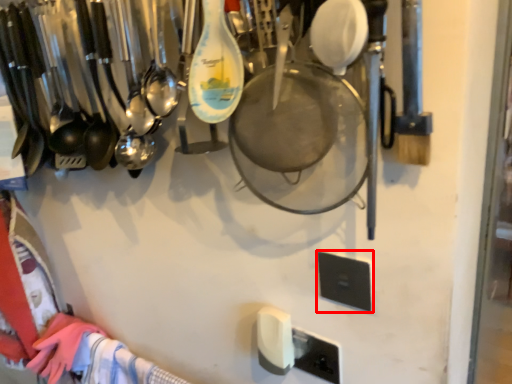
Question: From the image's perspective, where is light switch (annotated by the red box) located in relation to light switch in the image?

Choices:
 (A) below
 (B) above

Answer: (B)